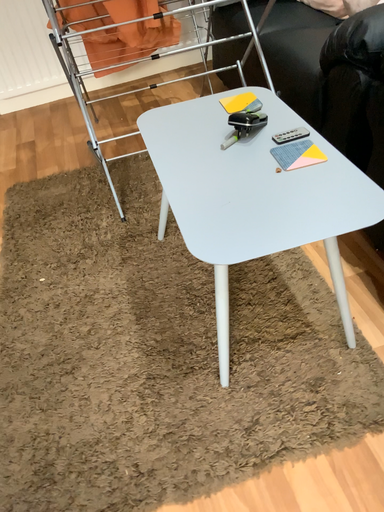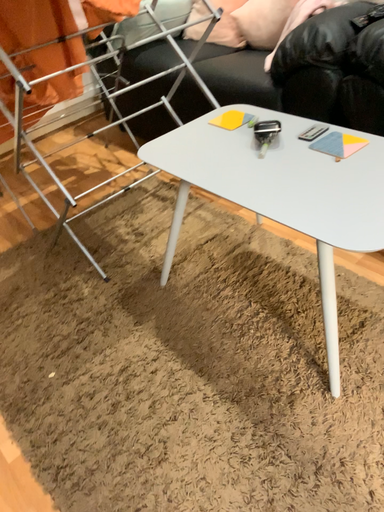
Question: How did the camera likely rotate when shooting the video?

Choices:
 (A) rotated upward
 (B) rotated downward

Answer: (A)